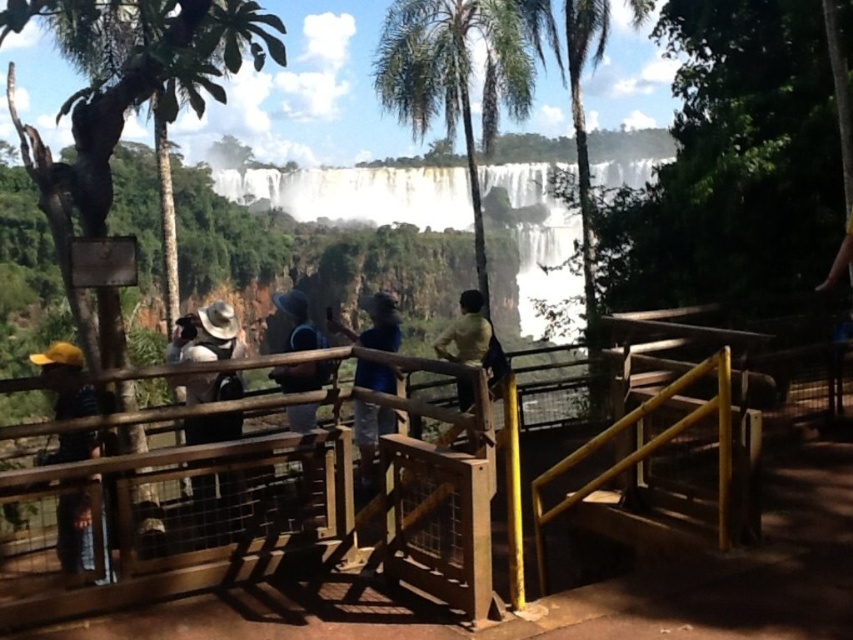
You are standing on the wooden viewing platform at the waterfall and want to take a photo. There are two points marked in the scene. The first point is at coordinate point (223, 372) and the second is at point (482, 317). Which point is closer to your current position on the platform?

Point (223, 372) is closer to the camera than point (482, 317), so the first point is closer to your current position on the platform.

In the scene shown: You are a photographer standing on the wooden viewing platform at the waterfall. You notice a brown fabric hat at center and a green matte shirt at center in your frame. Which object should you adjust your camera to focus on first if you want to capture the person on the left side of the scene?

The brown fabric hat at center is positioned on the left side of green matte shirt at center, so you should focus on the brown fabric hat at center first to capture the person on the left side of the scene.

You are standing on the wooden viewing platform and want to take a photo of the green leafy palm tree at center. What are the coordinates of the tree?

The green leafy palm tree at center is located at coordinates point (456,77).